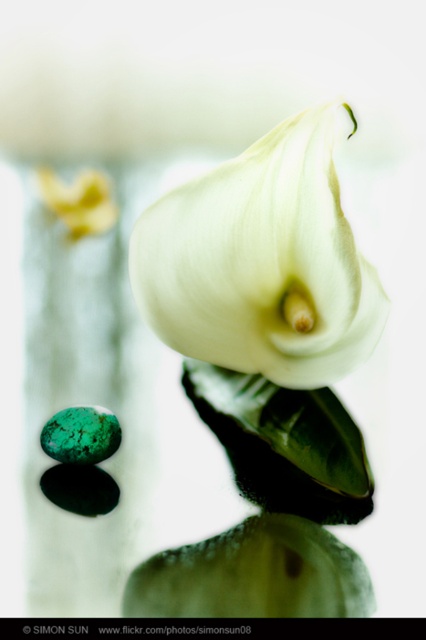
Describe the element at coordinates (261, 262) in the screenshot. This screenshot has height=640, width=426. I see `white matte calla lily at center` at that location.

Does white matte calla lily at center lie behind emerald-green polished stone at lower left?

No.

Image resolution: width=426 pixels, height=640 pixels. What do you see at coordinates (261, 262) in the screenshot?
I see `white matte calla lily at center` at bounding box center [261, 262].

Image resolution: width=426 pixels, height=640 pixels. I want to click on white matte calla lily at center, so click(x=261, y=262).